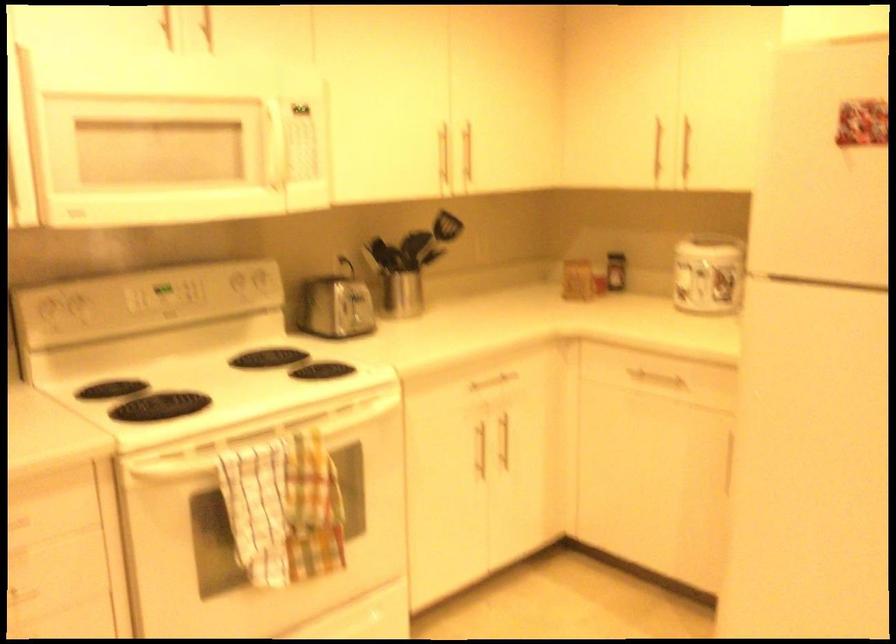
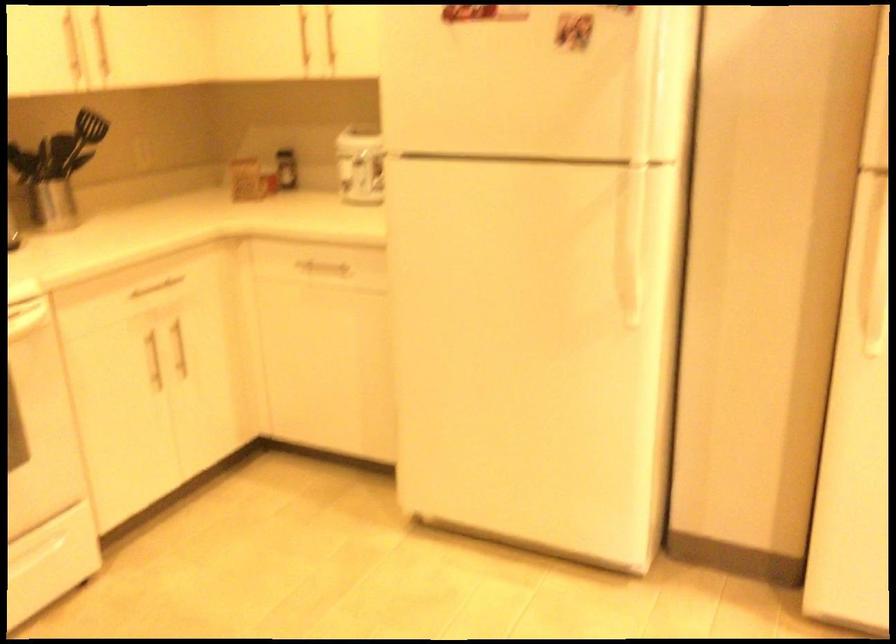
Question: Which direction would the cameraman need to move to produce the second image? Reply with the corresponding letter.

Choices:
 (A) Left
 (B) Right
 (C) Forward
 (D) Backward

Answer: (B)